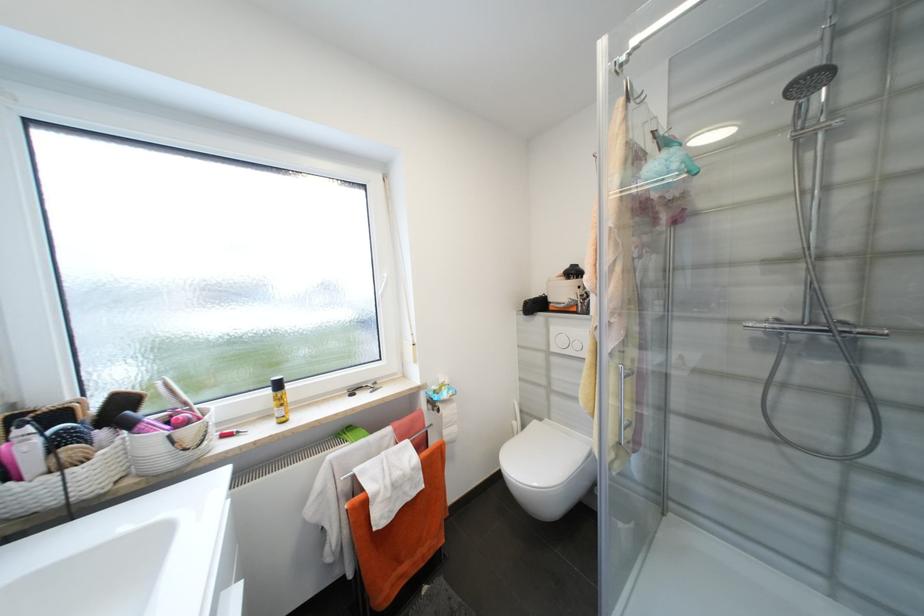
The width and height of the screenshot is (924, 616). What do you see at coordinates (280, 399) in the screenshot?
I see `the yellow spray can` at bounding box center [280, 399].